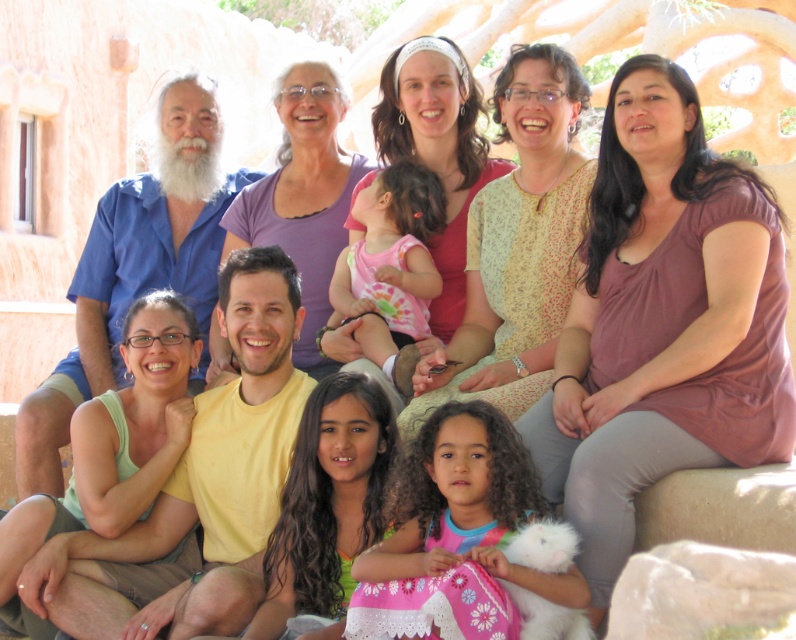
What do you see at coordinates (326, 500) in the screenshot? I see `brown hair at center` at bounding box center [326, 500].

Between point (302, 589) and point (287, 72), which one is positioned behind?

Positioned behind is point (287, 72).

This screenshot has height=640, width=796. Identify the location of brown hair at center. (326, 500).

Which is above, pink fabric at center or pink tie-dye shirt at center?

pink fabric at center

Find the location of `pink fabric at center`. pink fabric at center is located at coordinates (436, 150).

Measure the distance between point (436, 48) and camera.

51.57 meters

At what (x,y) coordinates should I click in order to perform the action: click on pink fabric at center. Please return your answer as a coordinate pair (x, y). Looking at the image, I should click on (436, 150).

Does blue cotton shirt at upper left appear on the right side of pink tie-dye shirt at center?

Incorrect, blue cotton shirt at upper left is not on the right side of pink tie-dye shirt at center.

Can you confirm if blue cotton shirt at upper left is thinner than pink tie-dye shirt at center?

Incorrect, blue cotton shirt at upper left's width is not less than pink tie-dye shirt at center's.

Describe the element at coordinates (135, 268) in the screenshot. The image size is (796, 640). I see `blue cotton shirt at upper left` at that location.

The image size is (796, 640). Identify the location of blue cotton shirt at upper left. (135, 268).